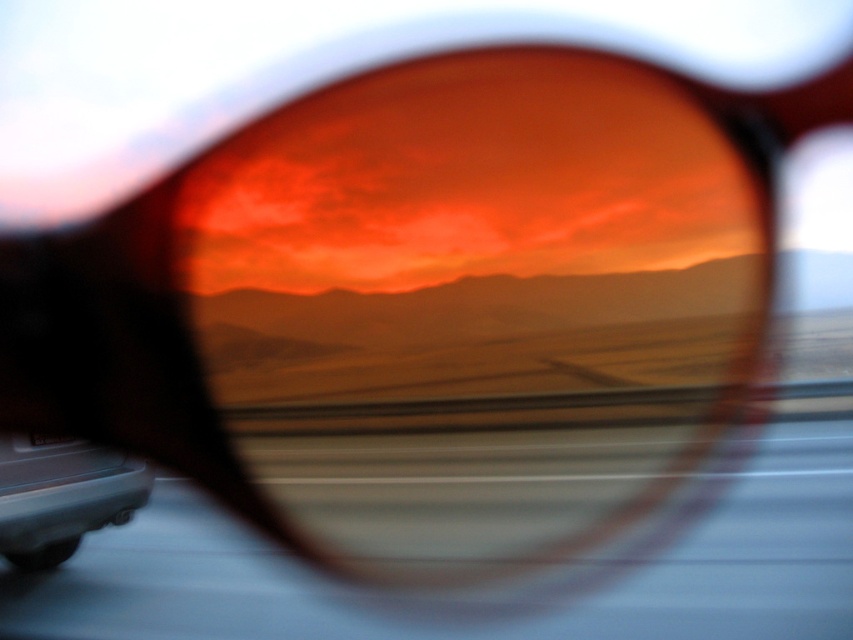
Question: From the image, what is the correct spatial relationship of matte orange lens at center in relation to matte gray car at lower left?

Choices:
 (A) left
 (B) right

Answer: (B)

Question: Can you confirm if matte orange lens at center is wider than matte gray car at lower left?

Choices:
 (A) yes
 (B) no

Answer: (A)

Question: Can you confirm if matte orange lens at center is wider than matte gray car at lower left?

Choices:
 (A) no
 (B) yes

Answer: (B)